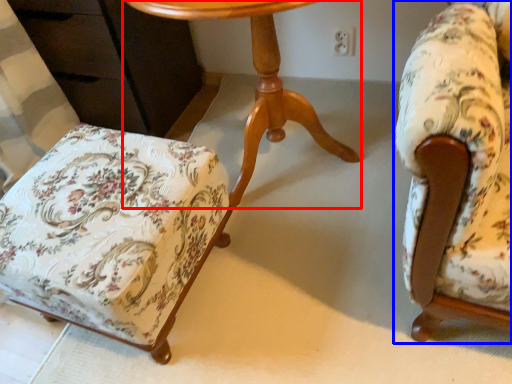
Question: Among these objects, which one is nearest to the camera, table (highlighted by a red box) or chair (highlighted by a blue box)?

Choices:
 (A) table
 (B) chair

Answer: (B)